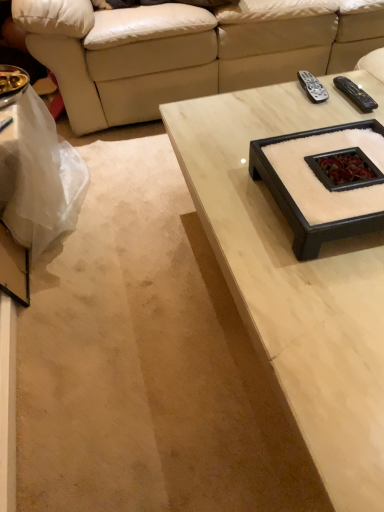
This screenshot has width=384, height=512. Identify the location of free space to the left of black plastic remote at upper right, placed as the 1th remote when sorted from left to right. (267, 101).